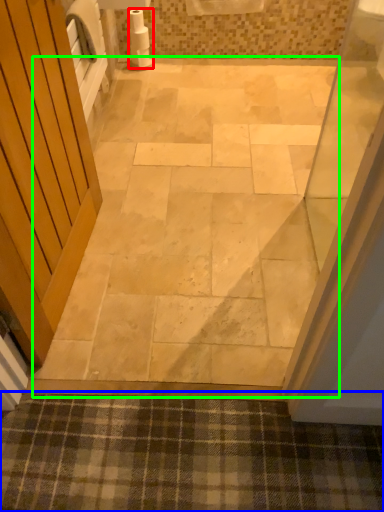
Question: Which object is the farthest from toilet paper (highlighted by a red box)? Choose among these: bath mat (highlighted by a blue box) or path (highlighted by a green box).

Choices:
 (A) bath mat
 (B) path

Answer: (A)